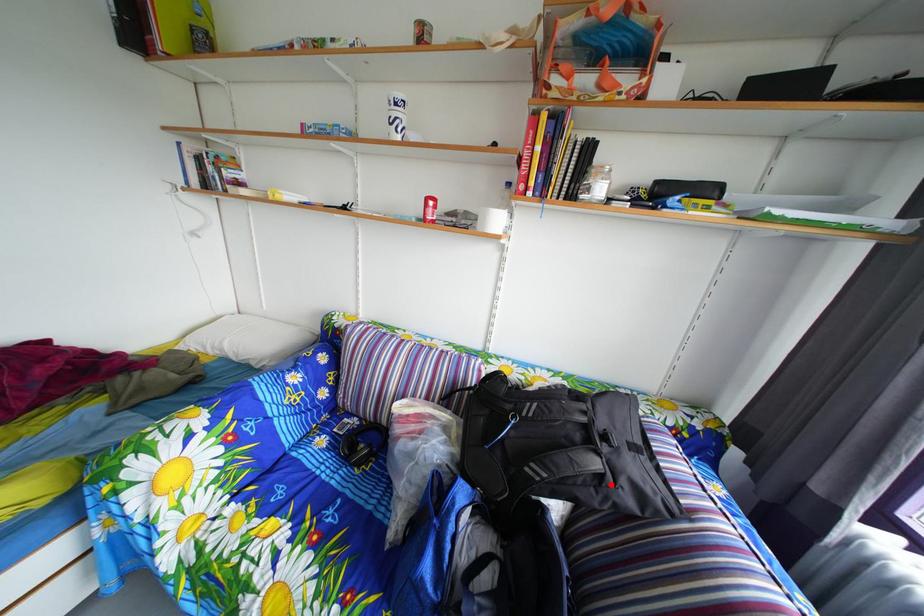
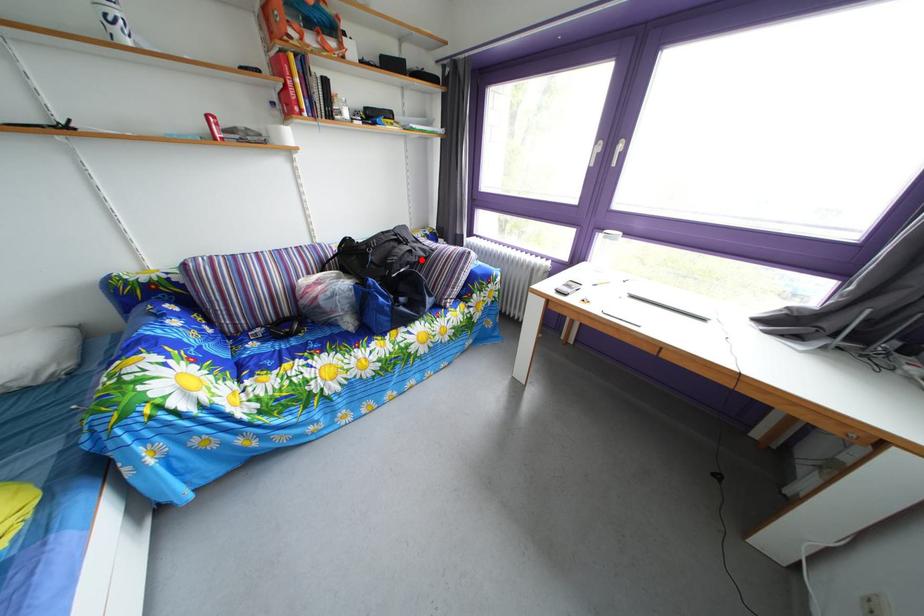
I am providing you with two images of the same scene from different viewpoints. A red point is marked on the first image and another point is marked on the second image. Is the marked point in image1 the same physical position as the marked point in image2?

Yes